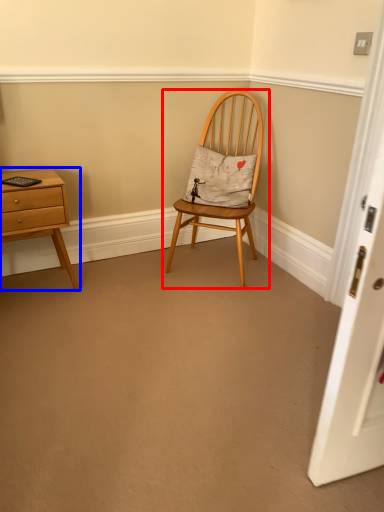
Question: Which object is closer to the camera taking this photo, chair (highlighted by a red box) or nightstand (highlighted by a blue box)?

Choices:
 (A) chair
 (B) nightstand

Answer: (B)